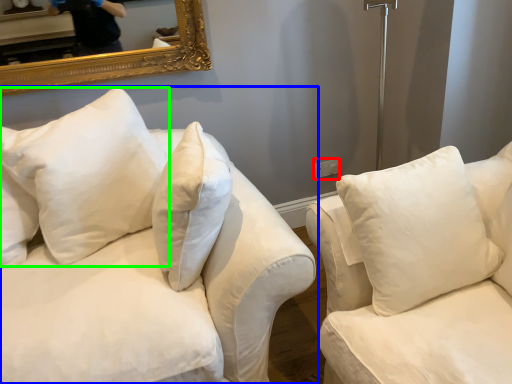
Question: Considering the real-world distances, which object is farthest from electric outlet (highlighted by a red box)? studio couch (highlighted by a blue box) or pillow (highlighted by a green box)?

Choices:
 (A) studio couch
 (B) pillow

Answer: (A)